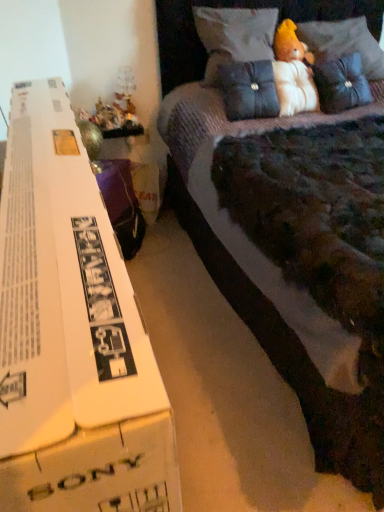
You are a GUI agent. You are given a task and a screenshot of the screen. Output one action in this format:
    pyautogui.click(x=<x>, y=<y>)
    Task: Click on the fluffy white teddy bear at upper right, marked as the 2th toy in a bottom-to-top arrangement
    The height and width of the screenshot is (512, 384).
    Given the screenshot: What is the action you would take?
    pyautogui.click(x=290, y=44)

Measure the distance between point (278,29) and camera.

Point (278,29) and camera are 2.25 meters apart from each other.

What are the coordinates of `velvet purple bed at center` in the screenshot? It's located at (238, 7).

This screenshot has width=384, height=512. Find the location of `velvet dark blue pillow at upper right, the first pillow when ordered from right to left`. velvet dark blue pillow at upper right, the first pillow when ordered from right to left is located at coordinates (341, 84).

Locate an element on the screen. This screenshot has width=384, height=512. white cardboard box at left is located at coordinates (72, 334).

Based on their sizes in the image, would you say metallic gold figurine at left, the second toy from the top, is bigger or smaller than suede-like dark blue pillow at center, the 2th pillow from the right?

In the image, metallic gold figurine at left, the second toy from the top, appears to be smaller than suede-like dark blue pillow at center, the 2th pillow from the right.

Can you confirm if metallic gold figurine at left, which appears as the 1th toy when viewed from the left, is taller than suede-like dark blue pillow at center, which is the 2th pillow from left to right?

No, metallic gold figurine at left, which appears as the 1th toy when viewed from the left, is not taller than suede-like dark blue pillow at center, which is the 2th pillow from left to right.

Is metallic gold figurine at left, the 2th toy when ordered from right to left, oriented towards suede-like dark blue pillow at center, which is the 2th pillow from left to right?

No, metallic gold figurine at left, the 2th toy when ordered from right to left, is not facing towards suede-like dark blue pillow at center, which is the 2th pillow from left to right.

Can you see metallic gold figurine at left, which appears as the 1th toy when viewed from the left, touching suede-like dark blue pillow at center, the 2th pillow from the right?

No, metallic gold figurine at left, which appears as the 1th toy when viewed from the left, is not in contact with suede-like dark blue pillow at center, the 2th pillow from the right.

In the image, is suede-like dark blue pillow at center, which is the 2th pillow from left to right, positioned in front of or behind metallic gold figurine at left, the 2th toy when ordered from right to left?

suede-like dark blue pillow at center, which is the 2th pillow from left to right, is in front of metallic gold figurine at left, the 2th toy when ordered from right to left.

Considering the points (260, 116) and (113, 123), which point is behind, point (260, 116) or point (113, 123)?

The point (113, 123) is behind.

How different are the orientations of suede-like dark blue pillow at center, the 2th pillow from the right, and metallic gold figurine at left, which appears as the 1th toy when viewed from the left, in degrees?

There is a 24.1-degree angle between the facing directions of suede-like dark blue pillow at center, the 2th pillow from the right, and metallic gold figurine at left, which appears as the 1th toy when viewed from the left.

Is suede-like dark blue pillow at center, the 2th pillow from the right, positioned with its back to metallic gold figurine at left, arranged as the 1th toy when ordered from the bottom?

No.

Could you tell me if velvet purple bed at center is facing metallic gold figurine at left, arranged as the 1th toy when ordered from the bottom?

No, velvet purple bed at center is not facing towards metallic gold figurine at left, arranged as the 1th toy when ordered from the bottom.

In terms of size, does velvet purple bed at center appear bigger or smaller than metallic gold figurine at left, arranged as the 1th toy when ordered from the bottom?

Clearly, velvet purple bed at center is larger in size than metallic gold figurine at left, arranged as the 1th toy when ordered from the bottom.

Does velvet purple bed at center come behind metallic gold figurine at left, which appears as the 1th toy when viewed from the left?

That is False.

Is metallic gold figurine at left, which appears as the 1th toy when viewed from the left, surrounded by white cardboard box at left?

Definitely not — metallic gold figurine at left, which appears as the 1th toy when viewed from the left, is not inside white cardboard box at left.

Is white cardboard box at left shorter than metallic gold figurine at left, which appears as the 1th toy when viewed from the left?

In fact, white cardboard box at left may be taller than metallic gold figurine at left, which appears as the 1th toy when viewed from the left.

Is white cardboard box at left far from metallic gold figurine at left, the 2th toy when ordered from right to left?

white cardboard box at left is far away from metallic gold figurine at left, the 2th toy when ordered from right to left.

From a real-world perspective, who is located lower, white cardboard box at left or metallic gold figurine at left, arranged as the 1th toy when ordered from the bottom?

white cardboard box at left, from a real-world perspective.

Does suede-like dark blue pillow at center, which is the 2th pillow from left to right, come behind white cardboard box at left?

Yes, suede-like dark blue pillow at center, which is the 2th pillow from left to right, is further from the camera.

Is suede-like dark blue pillow at center, the 2th pillow from the right, oriented away from white cardboard box at left?

No.

Considering the relative sizes of suede-like dark blue pillow at center, the 2th pillow from the right, and white cardboard box at left in the image provided, is suede-like dark blue pillow at center, the 2th pillow from the right, bigger than white cardboard box at left?

Incorrect, suede-like dark blue pillow at center, the 2th pillow from the right, is not larger than white cardboard box at left.

Is velvet dark blue pillow at upper right, the first pillow when ordered from right to left, far from metallic gold figurine at left, the second toy from the top?

Yes, velvet dark blue pillow at upper right, the first pillow when ordered from right to left, and metallic gold figurine at left, the second toy from the top, are quite far apart.

Can you confirm if velvet dark blue pillow at upper right, the third pillow positioned from the left, is wider than metallic gold figurine at left, the 2th toy when ordered from right to left?

Correct, the width of velvet dark blue pillow at upper right, the third pillow positioned from the left, exceeds that of metallic gold figurine at left, the 2th toy when ordered from right to left.

Is velvet dark blue pillow at upper right, the first pillow when ordered from right to left, taller than metallic gold figurine at left, which appears as the 1th toy when viewed from the left?

Indeed, velvet dark blue pillow at upper right, the first pillow when ordered from right to left, has a greater height compared to metallic gold figurine at left, which appears as the 1th toy when viewed from the left.

The image size is (384, 512). Identify the location of toy lying below the velvet dark blue pillow at upper right, the third pillow positioned from the left (from the image's perspective). click(106, 116).

Considering the positions of objects velvet purple bed at center and suede-like dark blue pillow at center, the 2th pillow from the right, in the image provided, who is more to the right, velvet purple bed at center or suede-like dark blue pillow at center, the 2th pillow from the right,?

From the viewer's perspective, velvet purple bed at center appears more on the right side.

Which of these two, velvet purple bed at center or suede-like dark blue pillow at center, the 2th pillow from the right, is thinner?

suede-like dark blue pillow at center, the 2th pillow from the right.

Based on their sizes in the image, would you say velvet purple bed at center is bigger or smaller than suede-like dark blue pillow at center, which is the 2th pillow from left to right?

Clearly, velvet purple bed at center is larger in size than suede-like dark blue pillow at center, which is the 2th pillow from left to right.

Is velvet purple bed at center spatially inside suede-like dark blue pillow at center, which is the 2th pillow from left to right, or outside of it?

The correct answer is: outside.

From the image's perspective, which pillow is the 1st one above the metallic gold figurine at left, the 2th toy when ordered from right to left? Please provide its 2D coordinates.

[(249, 90)]

The height and width of the screenshot is (512, 384). In order to click on the 2nd pillow to the right when counting from the metallic gold figurine at left, the 2th toy when ordered from right to left in this screenshot , I will do `click(249, 90)`.

From the image, which object appears to be nearer to fluffy white teddy bear at upper right, the second toy viewed from the left, velvet purple bed at center or velvet dark blue pillow at upper right, the third pillow positioned from the left?

The object closer to fluffy white teddy bear at upper right, the second toy viewed from the left, is velvet dark blue pillow at upper right, the third pillow positioned from the left.

Which object lies further to the anchor point velvet blue pillow at upper center, the 1th pillow in the left-to-right sequence, white cardboard box at left or velvet purple bed at center?

white cardboard box at left lies further to velvet blue pillow at upper center, the 1th pillow in the left-to-right sequence, than the other object.

From the picture: When comparing their distances from velvet blue pillow at upper center, the 1th pillow in the left-to-right sequence, does fluffy white teddy bear at upper right, the second toy viewed from the left, or white cardboard box at left seem further?

white cardboard box at left.

Which object lies nearer to the anchor point white cardboard box at left, velvet dark blue pillow at upper right, the first pillow when ordered from right to left, or suede-like dark blue pillow at center, which is the 2th pillow from left to right?

suede-like dark blue pillow at center, which is the 2th pillow from left to right.

Based on their spatial positions, is velvet blue pillow at upper center, the third pillow viewed from the right, or velvet purple bed at center further from velvet dark blue pillow at upper right, the first pillow when ordered from right to left?

velvet purple bed at center.

Based on their spatial positions, is white cardboard box at left or fluffy white teddy bear at upper right, marked as the 2th toy in a bottom-to-top arrangement, further from velvet purple bed at center?

white cardboard box at left is further to velvet purple bed at center.

Estimate the real-world distances between objects in this image. Which object is further from fluffy white teddy bear at upper right, the second toy viewed from the left, white cardboard box at left or velvet dark blue pillow at upper right, the third pillow positioned from the left?

white cardboard box at left.

When comparing their distances from velvet purple bed at center, does metallic gold figurine at left, the second toy from the top, or velvet dark blue pillow at upper right, the third pillow positioned from the left, seem closer?

velvet dark blue pillow at upper right, the third pillow positioned from the left, lies closer to velvet purple bed at center than the other object.

The height and width of the screenshot is (512, 384). In order to click on toy positioned between white cardboard box at left and metallic gold figurine at left, the 2th toy when ordered from right to left, from near to far in this screenshot , I will do `click(290, 44)`.

Where is `bed between white cardboard box at left and velvet dark blue pillow at upper right, the third pillow positioned from the left, along the z-axis`? The width and height of the screenshot is (384, 512). bed between white cardboard box at left and velvet dark blue pillow at upper right, the third pillow positioned from the left, along the z-axis is located at coordinates (238, 7).

At what (x,y) coordinates should I click in order to perform the action: click on toy between metallic gold figurine at left, the second toy from the top, and velvet dark blue pillow at upper right, the first pillow when ordered from right to left. Please return your answer as a coordinate pair (x, y). Looking at the image, I should click on (290, 44).

I want to click on bed located between white cardboard box at left and fluffy white teddy bear at upper right, the 1th toy when ordered from top to bottom, in the depth direction, so click(x=238, y=7).